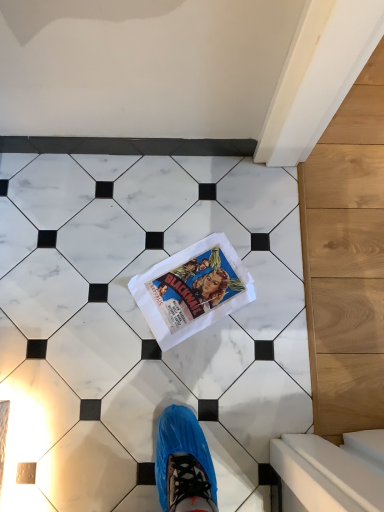
Where is `free spot behind white paper comic book at center`? Image resolution: width=384 pixels, height=512 pixels. free spot behind white paper comic book at center is located at coordinates (196, 207).